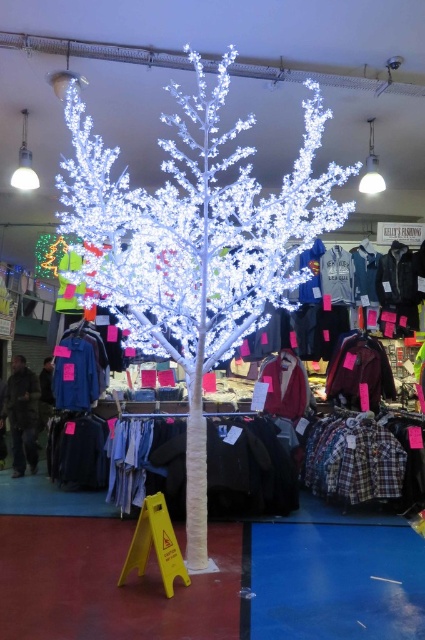
You are standing in a store and see the white textured tree at center and the velvet maroon jacket at center. Which object is nearer to you?

The white textured tree at center is closer to the viewer than the velvet maroon jacket at center, so the white textured tree at center is nearer to you.

You are a customer browsing the store and want to know which item is taller between the dark brown leather jacket at left and the blue denim shirt at left. Can you determine this based on their positions?

The dark brown leather jacket at left is taller than the blue denim shirt at left, so the dark brown leather jacket at left is taller.